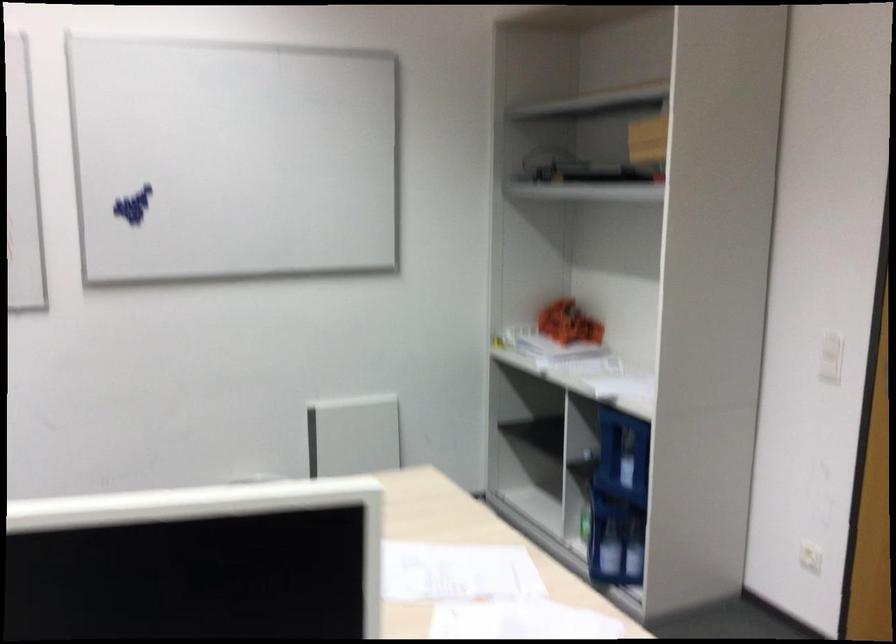
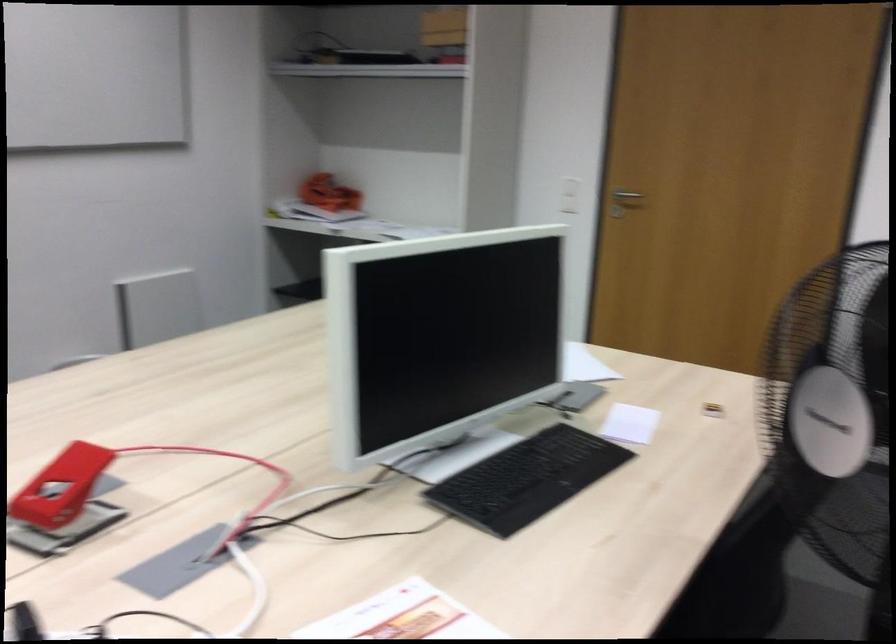
Locate, in the second image, the point that corresponds to (658,137) in the first image.

(444, 26)